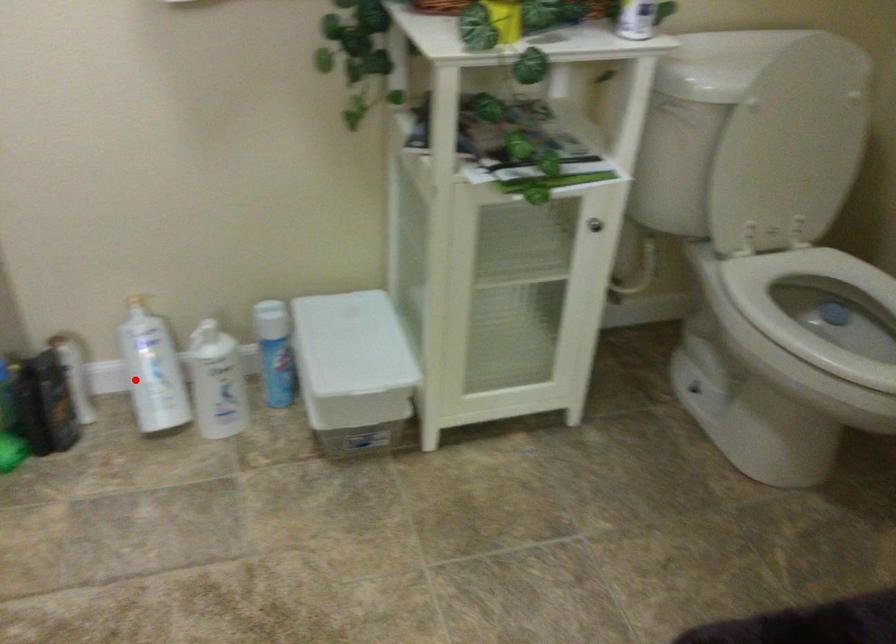
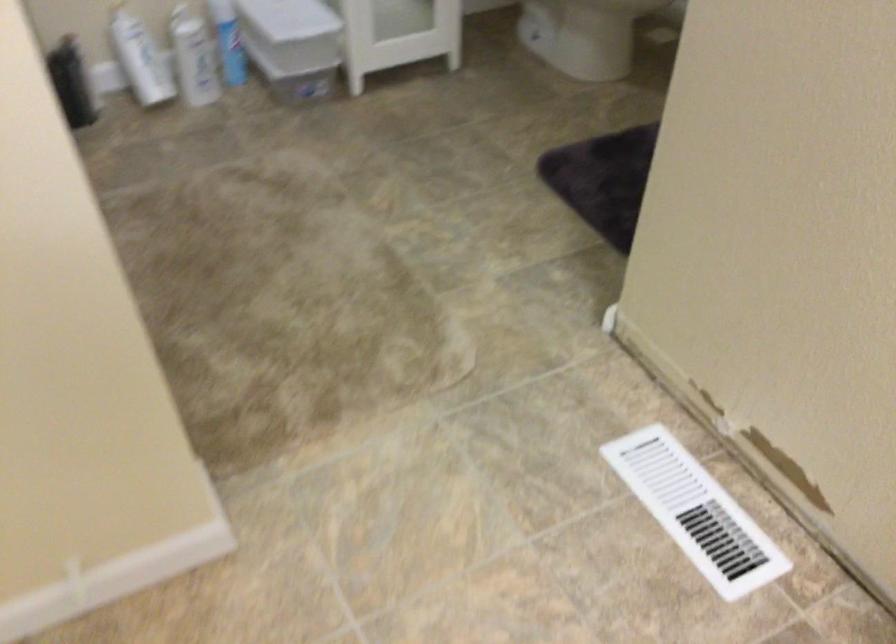
Question: I am providing you with two images of the same scene from different viewpoints. In image1, a red point is highlighted. Considering the same 3D point in image2, which of the following is correct?

Choices:
 (A) It is closer
 (B) It is farther

Answer: (B)